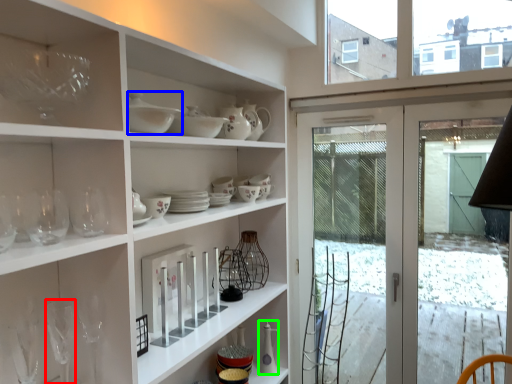
Question: Which object is positioned farthest from wine glass (highlighted by a red box)? Select from tableware (highlighted by a blue box) and tableware (highlighted by a green box).

Choices:
 (A) tableware
 (B) tableware

Answer: (B)